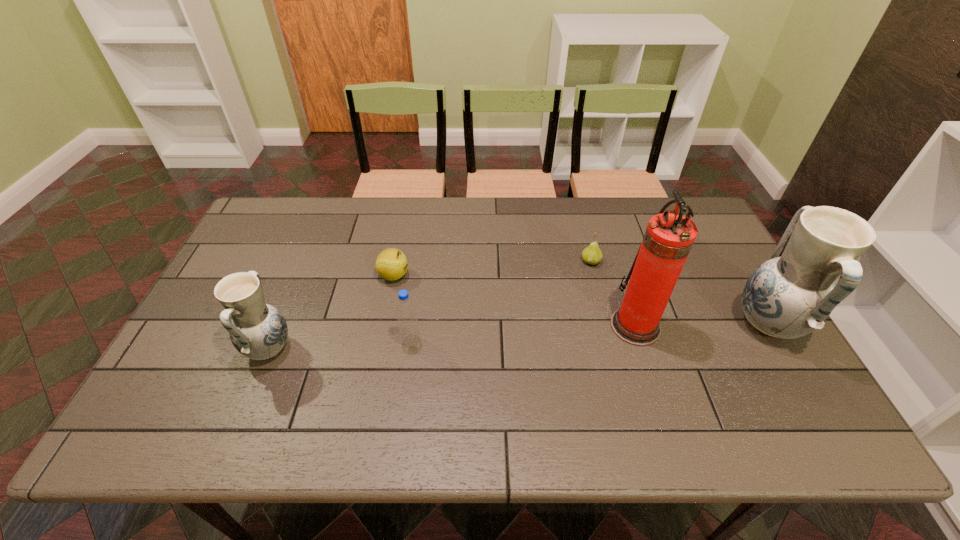
Identify the location of the third tallest object. The width and height of the screenshot is (960, 540). (257, 330).

Image resolution: width=960 pixels, height=540 pixels. I want to click on the left pottery, so click(x=257, y=330).

Identify the location of the right pottery. (792, 294).

What are the coordinates of `the fifth shortest object` in the screenshot? It's located at (792, 294).

The image size is (960, 540). What are the coordinates of `the fifth object from right to left` in the screenshot? It's located at (391, 264).

I want to click on pear, so click(x=592, y=254).

Identify the location of fire extinguisher. The height and width of the screenshot is (540, 960). (669, 237).

Identify the location of the third shortest object. The height and width of the screenshot is (540, 960). [x=406, y=313].

Locate an element on the screen. the third object from left to right is located at coordinates (406, 313).

In order to click on vacant space located 0.050m on either side of the fourth shortest object in this screenshot , I will do `click(226, 348)`.